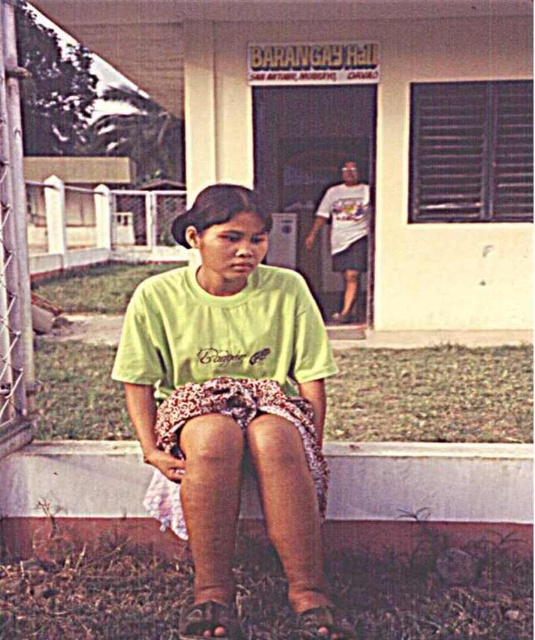
What do you see at coordinates (231, 403) in the screenshot? I see `green matte shirt at center` at bounding box center [231, 403].

Is point (300, 419) positioned in front of point (348, 500)?

Yes, point (300, 419) is closer to viewer.

Find the location of a particular element. green matte shirt at center is located at coordinates (231, 403).